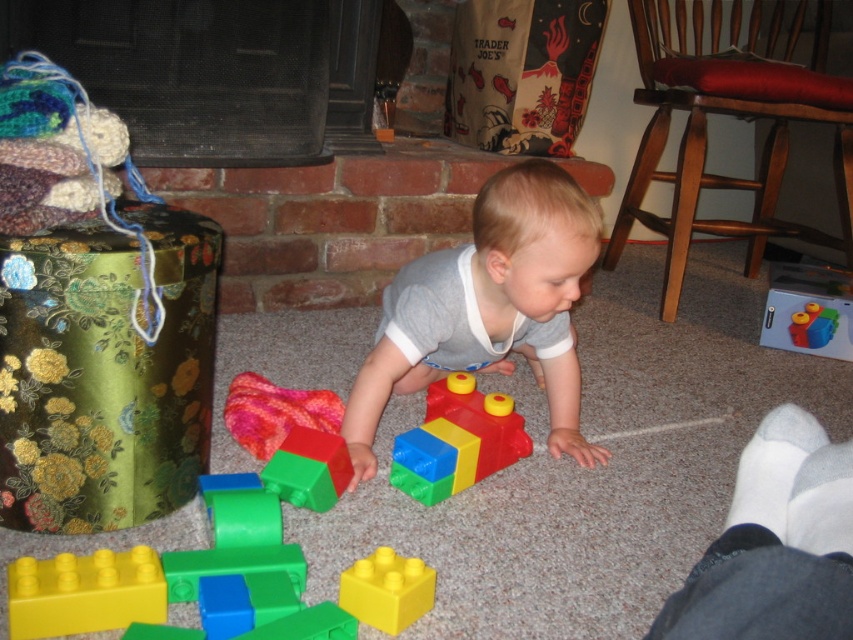
The child is trying to stack the yellow matte plastic block at center and the rubberized plastic blocks at center. Which one should they place first to build a stable tower?

The yellow matte plastic block at center should be placed first as it is positioned below the rubberized plastic blocks at center, making it the base of the tower.

You are a parent trying to organize your child play area. You want to place a storage bin between the smooth plastic blocks at center and the rubberized plastic blocks at center. The bin is 12 inches wide. Will it fit in the space between them?

The distance between the smooth plastic blocks at center and the rubberized plastic blocks at center is 12.65 inches. Since the storage bin is 12 inches wide, it will fit in the space between them as the available space is slightly larger than the bin.